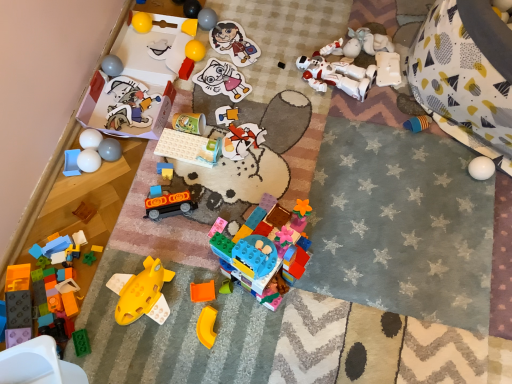
What are the coordinates of `unoccupied area in front of yellow matte block at center, which is counted as the eleventh toy, starting from the left` in the screenshot? It's located at (198, 72).